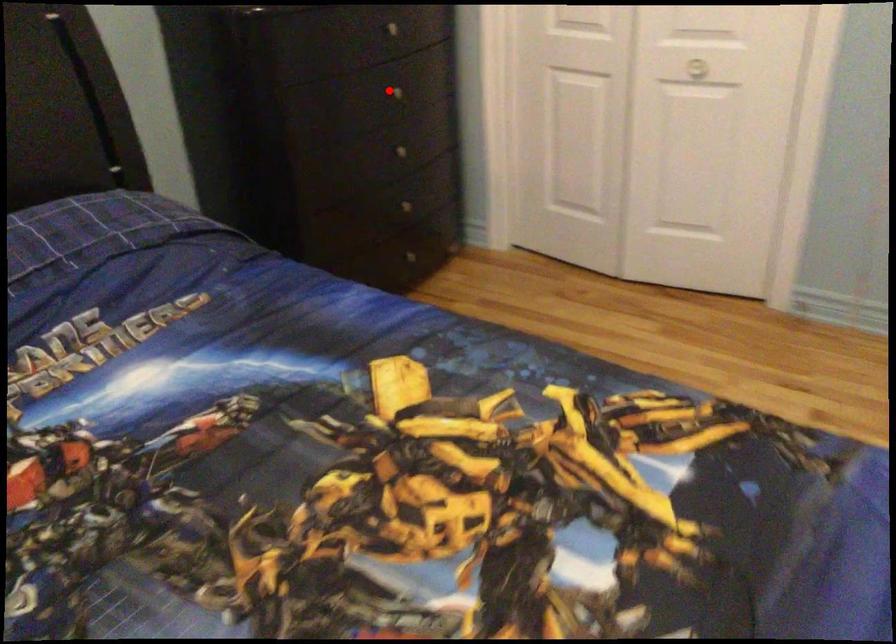
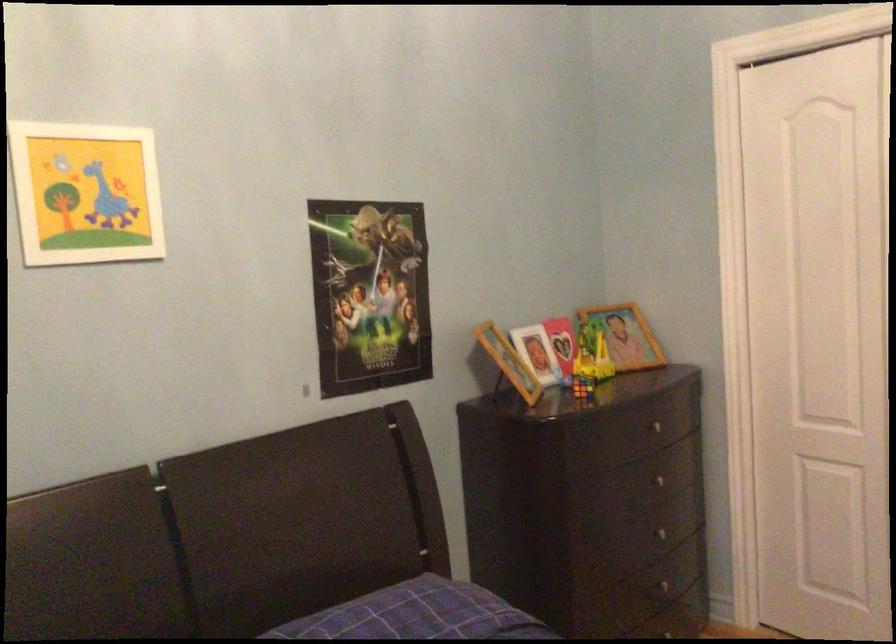
Find the pixel in the second image that matches the highlighted location in the first image.

(656, 480)